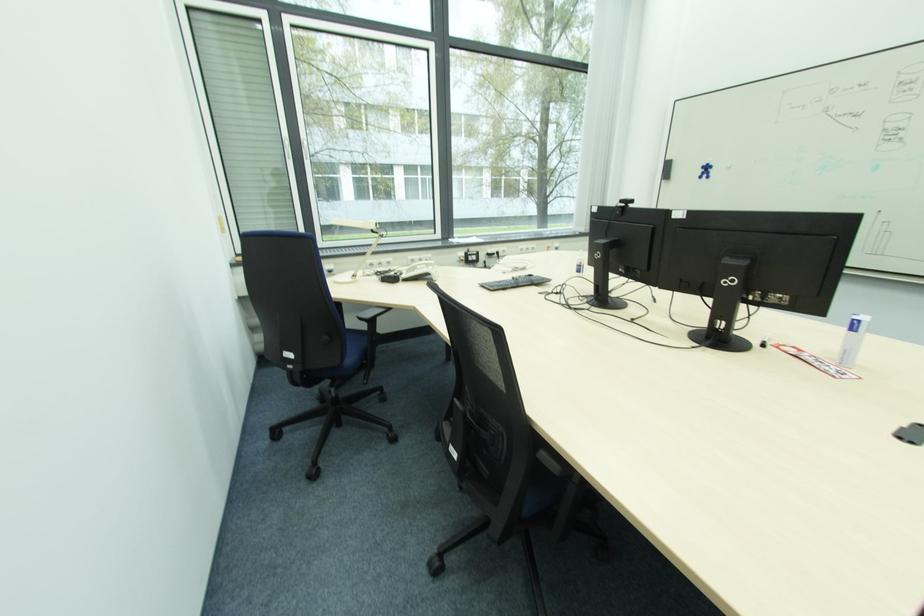
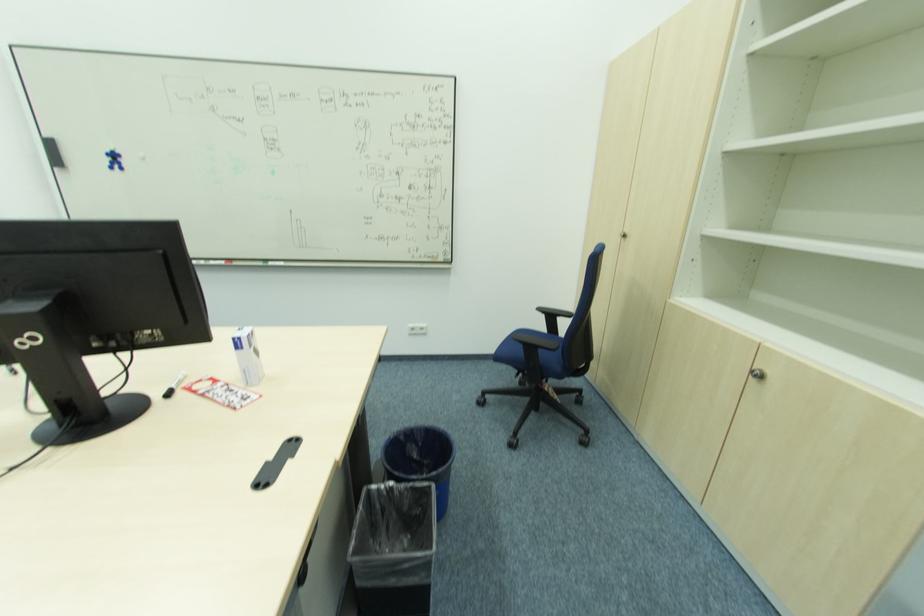
In the second image, find the point that corresponds to point (671, 161) in the first image.

(52, 140)